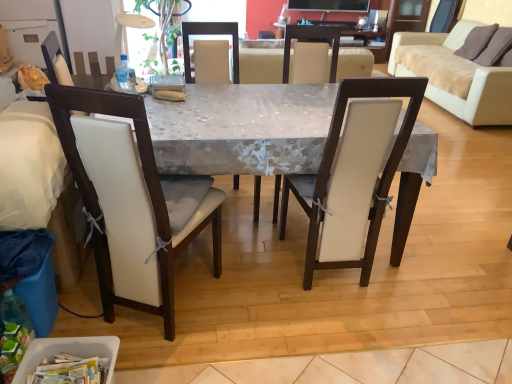
Question: Is white fabric chair at center, the third chair in the left-to-right sequence, next to white leather chair at center, which is the second chair from left to right?

Choices:
 (A) no
 (B) yes

Answer: (A)

Question: Is white fabric chair at center, which ranks as the second chair in right-to-left order, looking in the opposite direction of white leather chair at center, which is the second chair from left to right?

Choices:
 (A) no
 (B) yes

Answer: (A)

Question: Considering the relative positions of white fabric chair at center, the third chair in the left-to-right sequence, and white leather chair at center, which is counted as the 3th chair, starting from the right, in the image provided, is white fabric chair at center, the third chair in the left-to-right sequence, in front of white leather chair at center, which is counted as the 3th chair, starting from the right,?

Choices:
 (A) yes
 (B) no

Answer: (B)

Question: Does white fabric chair at center, the third chair in the left-to-right sequence, have a greater width compared to white leather chair at center, which is counted as the 3th chair, starting from the right?

Choices:
 (A) no
 (B) yes

Answer: (A)

Question: From the image's perspective, is white fabric chair at center, the third chair in the left-to-right sequence, on top of white leather chair at center, which is counted as the 3th chair, starting from the right?

Choices:
 (A) no
 (B) yes

Answer: (B)

Question: Considering the positions of white fabric chair at center, the third chair in the left-to-right sequence, and white plastic container at lower left in the image, is white fabric chair at center, the third chair in the left-to-right sequence, wider or thinner than white plastic container at lower left?

Choices:
 (A) thin
 (B) wide

Answer: (B)

Question: Considering the positions of white fabric chair at center, the third chair in the left-to-right sequence, and white plastic container at lower left in the image, is white fabric chair at center, the third chair in the left-to-right sequence, taller or shorter than white plastic container at lower left?

Choices:
 (A) short
 (B) tall

Answer: (B)

Question: Is white fabric chair at center, which ranks as the second chair in right-to-left order, to the left or to the right of white plastic container at lower left in the image?

Choices:
 (A) left
 (B) right

Answer: (B)

Question: From the image's perspective, is white fabric chair at center, which ranks as the second chair in right-to-left order, positioned above or below white plastic container at lower left?

Choices:
 (A) above
 (B) below

Answer: (A)

Question: From the image's perspective, relative to white leather studio couch at left, arranged as the second studio couch when viewed from the back, is white leather chair at center, which is counted as the 3th chair, starting from the right, above or below?

Choices:
 (A) below
 (B) above

Answer: (B)

Question: Based on their sizes in the image, would you say white leather chair at center, which is the second chair from left to right, is bigger or smaller than white leather studio couch at left, which is counted as the 1th studio couch, starting from the bottom?

Choices:
 (A) big
 (B) small

Answer: (A)

Question: Is point (189, 66) positioned closer to the camera than point (12, 213)?

Choices:
 (A) closer
 (B) farther

Answer: (B)

Question: Is white leather chair at center, which is counted as the 3th chair, starting from the right, inside or outside of white leather studio couch at left, arranged as the second studio couch when viewed from the back?

Choices:
 (A) outside
 (B) inside

Answer: (A)

Question: Is white leather chair at left, which is the 1th chair in left-to-right order, bigger or smaller than beige fabric couch at upper right, the first studio couch positioned from the back?

Choices:
 (A) big
 (B) small

Answer: (B)

Question: Is white leather chair at left, which is the 1th chair in left-to-right order, taller or shorter than beige fabric couch at upper right, the first studio couch positioned from the back?

Choices:
 (A) short
 (B) tall

Answer: (B)